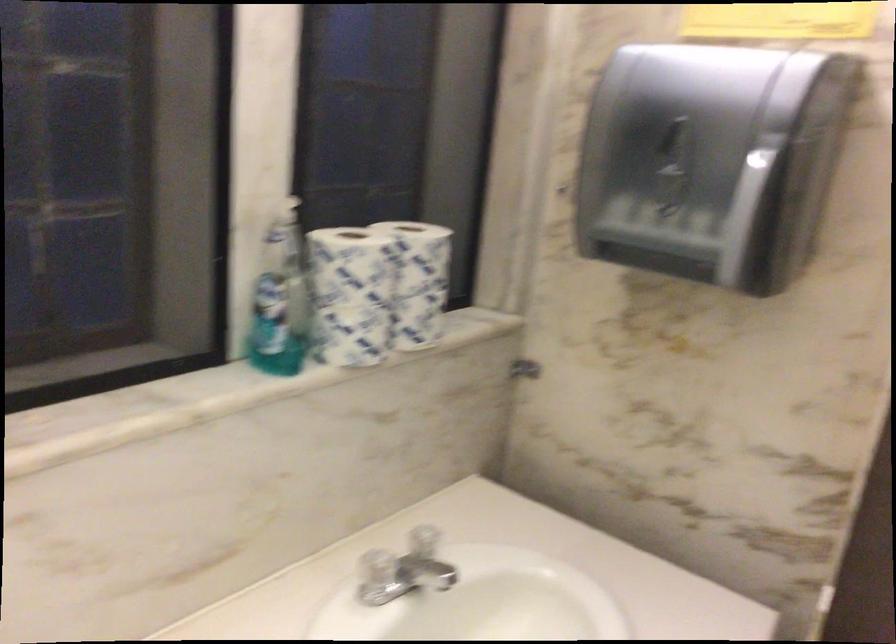
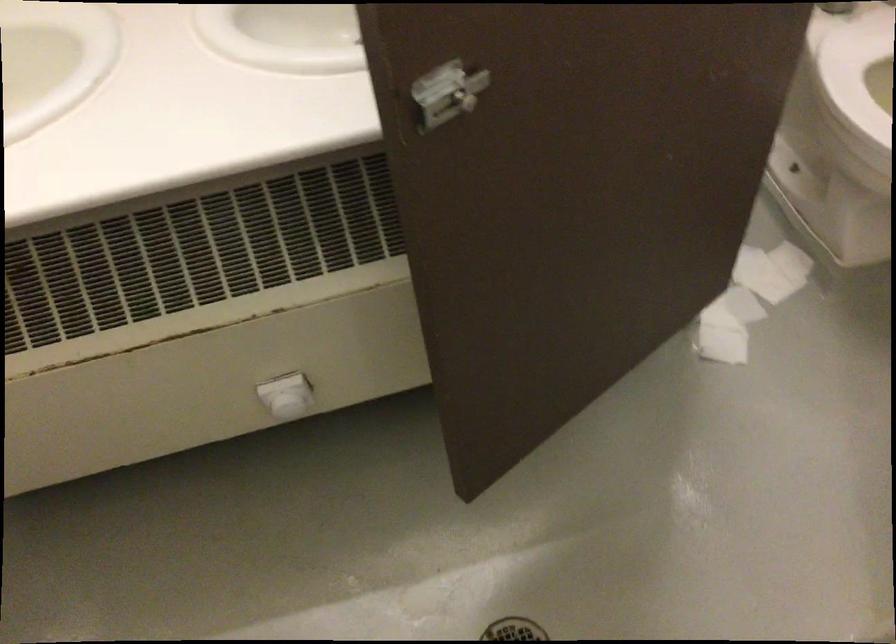
Based on the continuous images, in which direction is the camera rotating?

The rotation direction of the camera is left-down.